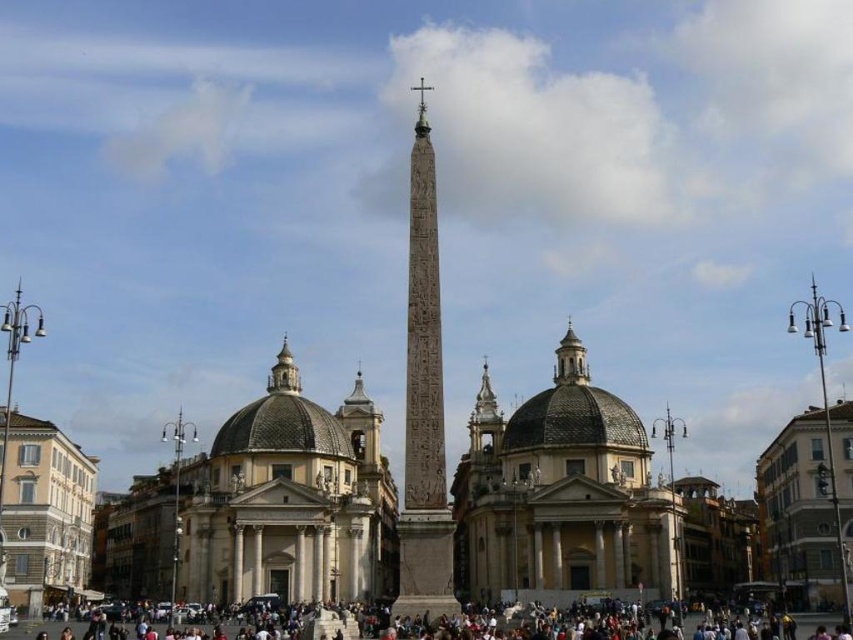
Is carved stone obelisk at center bigger than polished gold cross at center?

Yes.

From the picture: Can you confirm if carved stone obelisk at center is positioned to the right of polished gold cross at center?

In fact, carved stone obelisk at center is to the left of polished gold cross at center.

Describe the element at coordinates (424, 412) in the screenshot. I see `carved stone obelisk at center` at that location.

Find the location of a particular element. carved stone obelisk at center is located at coordinates (424, 412).

From the picture: Does beige stone dome at center have a greater height compared to matte gray crowd at lower center?

Indeed, beige stone dome at center has a greater height compared to matte gray crowd at lower center.

Which of these two, beige stone dome at center or matte gray crowd at lower center, stands taller?

Standing taller between the two is beige stone dome at center.

Locate an element on the screen. The height and width of the screenshot is (640, 853). beige stone dome at center is located at coordinates click(x=561, y=497).

Is point (347, 532) farther from camera compared to point (598, 621)?

Yes, point (347, 532) is behind point (598, 621).

Who is more forward, (258, 560) or (537, 627)?

Point (537, 627) is more forward.

The image size is (853, 640). Find the location of `light beige stone dome at center-left`. light beige stone dome at center-left is located at coordinates (293, 502).

Locate an element on the screen. Image resolution: width=853 pixels, height=640 pixels. light beige stone dome at center-left is located at coordinates [x=293, y=502].